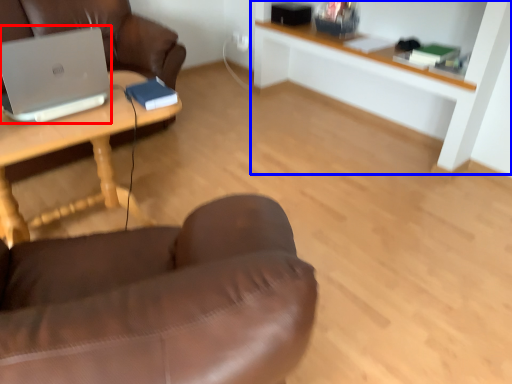
Question: Which of the following is the closest to the observer, laptop (highlighted by a red box) or shelf (highlighted by a blue box)?

Choices:
 (A) laptop
 (B) shelf

Answer: (A)